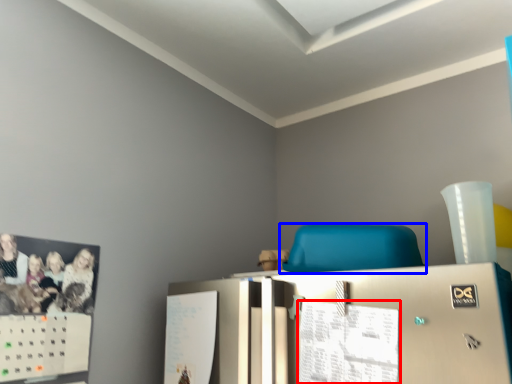
Question: Which object appears closest to the camera in this image, paper (highlighted by a red box) or furniture (highlighted by a blue box)?

Choices:
 (A) paper
 (B) furniture

Answer: (A)